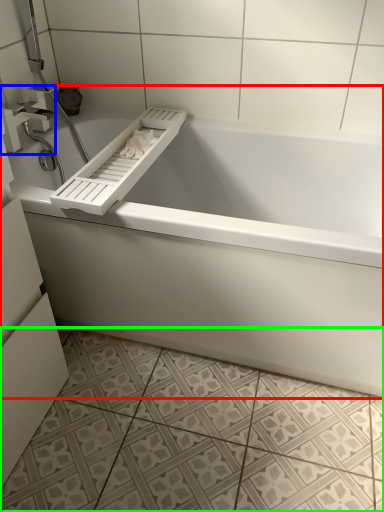
Question: Estimate the real-world distances between objects in this image. Which object is farther from bathtub (highlighted by a red box), tap (highlighted by a blue box) or ceramic tile (highlighted by a green box)?

Choices:
 (A) tap
 (B) ceramic tile

Answer: (A)